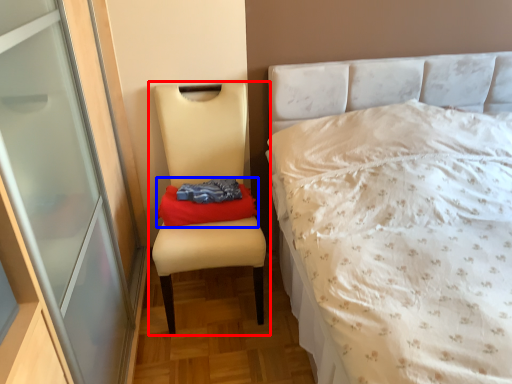
Question: Among these objects, which one is nearest to the camera, chair (highlighted by a red box) or material (highlighted by a blue box)?

Choices:
 (A) chair
 (B) material

Answer: (A)